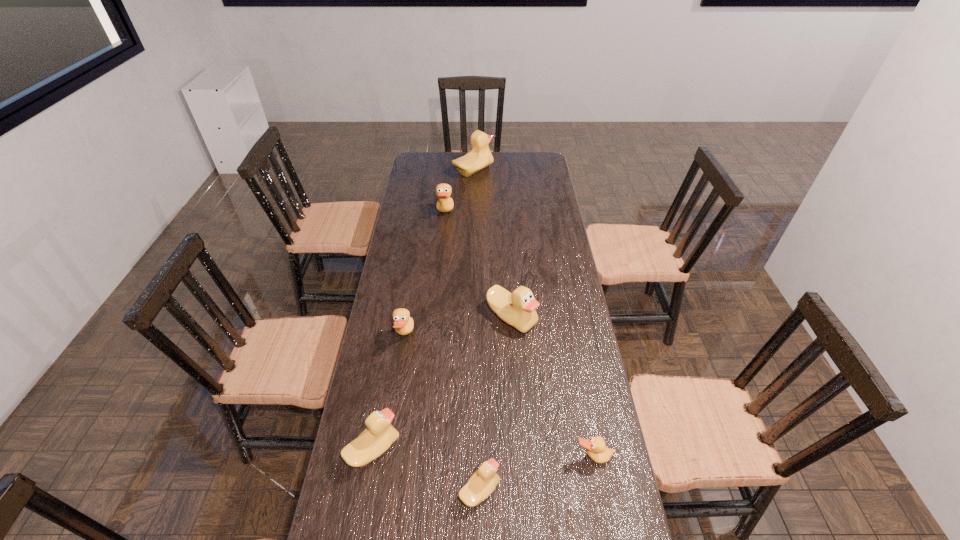
The image size is (960, 540). Find the location of `free space in the image that satisfies the following two spatial constraints: 1. at the beak of the second farthest beige duck; 2. at the beak of the smallest beige duck`. free space in the image that satisfies the following two spatial constraints: 1. at the beak of the second farthest beige duck; 2. at the beak of the smallest beige duck is located at coordinates (523, 490).

Image resolution: width=960 pixels, height=540 pixels. I want to click on vacant region that satisfies the following two spatial constraints: 1. at the beak of the third smallest beige duck; 2. at the beak of the smallest beige duck, so click(x=523, y=490).